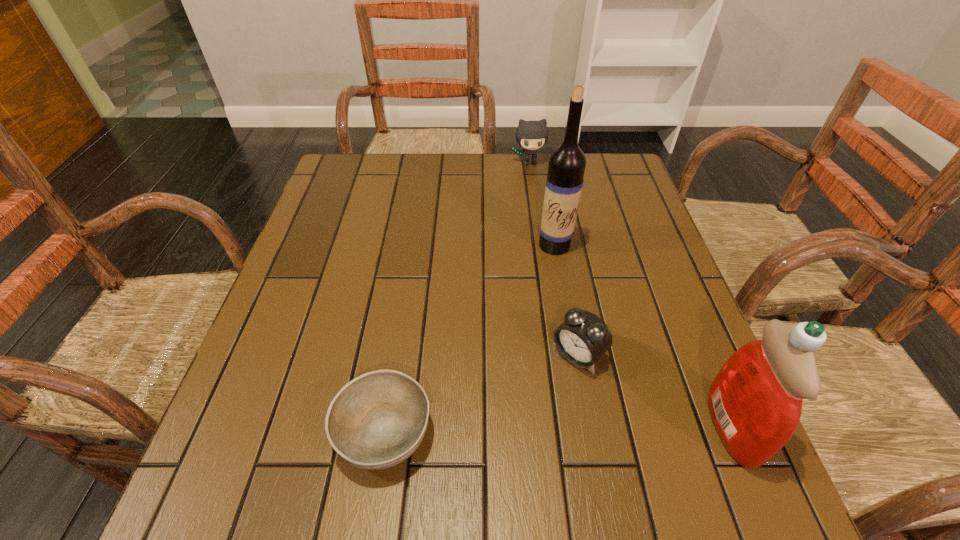
The image size is (960, 540). I want to click on vacant area at the near left corner of the desktop, so click(x=269, y=408).

Find the location of a particular element. vacant area at the far right corner is located at coordinates (619, 198).

I want to click on free space between the third farthest object and the leftmost object, so click(x=481, y=393).

The height and width of the screenshot is (540, 960). Identify the location of free space between the second tallest object and the third shortest object. (631, 294).

Find the location of a particular element. Image resolution: width=960 pixels, height=540 pixels. free area in between the detergent and the second shortest object is located at coordinates (655, 390).

Where is `vacant point located between the fourth tallest object and the shortest object`? This screenshot has height=540, width=960. vacant point located between the fourth tallest object and the shortest object is located at coordinates (481, 393).

Find the location of a particular element. The height and width of the screenshot is (540, 960). empty space between the third shortest object and the tallest object is located at coordinates tap(542, 204).

The height and width of the screenshot is (540, 960). Find the location of `vacant region between the second shortest object and the rightmost object`. vacant region between the second shortest object and the rightmost object is located at coordinates (655, 390).

At what (x,y) coordinates should I click in order to perform the action: click on free space between the farthest object and the leftmost object. Please return your answer as a coordinate pair (x, y). Looking at the image, I should click on (457, 297).

Locate an element on the screen. vacant space that is in between the third farthest object and the fourth shortest object is located at coordinates (655, 390).